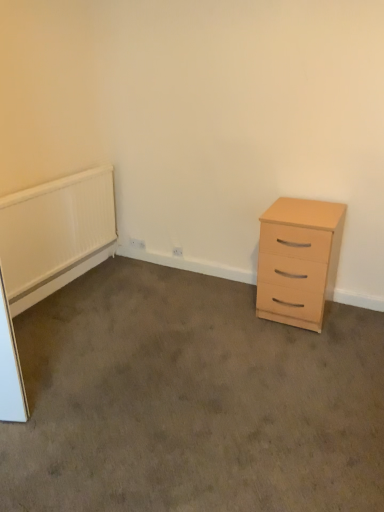
Identify the location of vacant point above light wood/finish chest of drawers at right (from a real-world perspective). (304, 205).